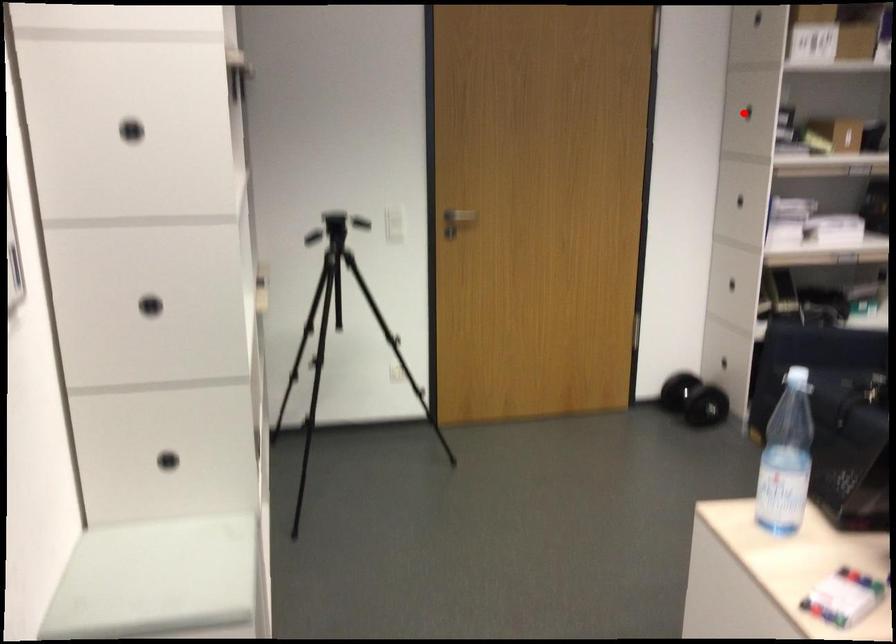
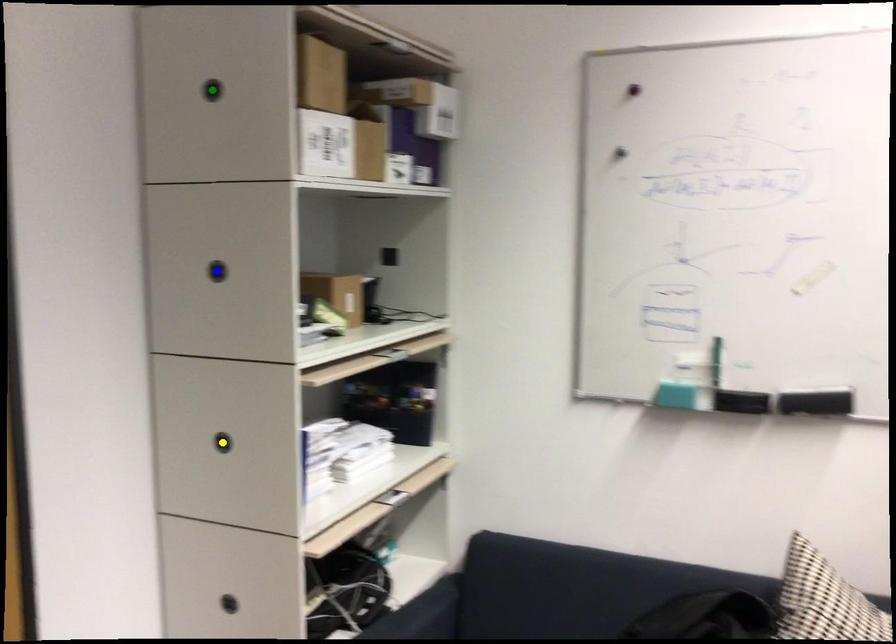
Question: I am providing you with two images of the same scene from different viewpoints. A red point is marked on the first image. You are given multiple points on the second image. Which point in image 2 represents the same 3d spot as the red point in image 1?

Choices:
 (A) blue point
 (B) green point
 (C) yellow point

Answer: (A)